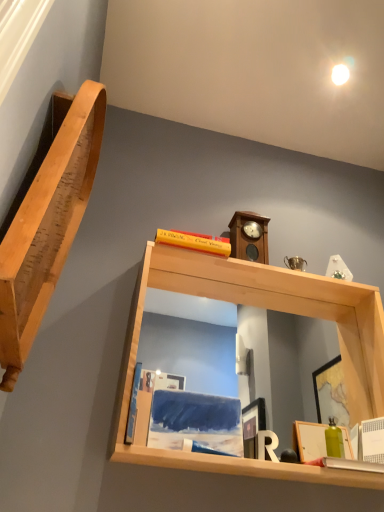
Question: Should I look upward or downward to see wooden clock at upper center?

Choices:
 (A) up
 (B) down

Answer: (A)

Question: Is light wood/matte mirror at upper center, arranged as the first shelf when viewed from the right, next to natural wood shelf at left, arranged as the 1th shelf when viewed from the left, and touching it?

Choices:
 (A) no
 (B) yes

Answer: (A)

Question: Can you confirm if light wood/matte mirror at upper center, the second shelf from the left, is shorter than natural wood shelf at left, arranged as the 1th shelf when viewed from the left?

Choices:
 (A) yes
 (B) no

Answer: (A)

Question: Is light wood/matte mirror at upper center, the second shelf from the left, located outside natural wood shelf at left, arranged as the 1th shelf when viewed from the left?

Choices:
 (A) no
 (B) yes

Answer: (B)

Question: From a real-world perspective, does light wood/matte mirror at upper center, arranged as the first shelf when viewed from the right, sit lower than natural wood shelf at left, arranged as the 1th shelf when viewed from the left?

Choices:
 (A) yes
 (B) no

Answer: (A)

Question: Considering the relative positions of light wood/matte mirror at upper center, arranged as the first shelf when viewed from the right, and natural wood shelf at left, placed as the 2th shelf when sorted from right to left, in the image provided, is light wood/matte mirror at upper center, arranged as the first shelf when viewed from the right, to the left of natural wood shelf at left, placed as the 2th shelf when sorted from right to left, from the viewer's perspective?

Choices:
 (A) no
 (B) yes

Answer: (A)

Question: Could you tell me if light wood/matte mirror at upper center, arranged as the first shelf when viewed from the right, is facing natural wood shelf at left, arranged as the 1th shelf when viewed from the left?

Choices:
 (A) no
 (B) yes

Answer: (A)

Question: Is natural wood shelf at left, placed as the 2th shelf when sorted from right to left, oriented towards light wood/matte mirror at upper center, the second shelf from the left?

Choices:
 (A) no
 (B) yes

Answer: (B)

Question: Is natural wood shelf at left, placed as the 2th shelf when sorted from right to left, smaller than light wood/matte mirror at upper center, the second shelf from the left?

Choices:
 (A) yes
 (B) no

Answer: (A)

Question: Does natural wood shelf at left, placed as the 2th shelf when sorted from right to left, have a greater height compared to light wood/matte mirror at upper center, the second shelf from the left?

Choices:
 (A) no
 (B) yes

Answer: (B)

Question: Does natural wood shelf at left, arranged as the 1th shelf when viewed from the left, appear on the left side of light wood/matte mirror at upper center, the second shelf from the left?

Choices:
 (A) no
 (B) yes

Answer: (B)

Question: Is natural wood shelf at left, arranged as the 1th shelf when viewed from the left, looking in the opposite direction of light wood/matte mirror at upper center, the second shelf from the left?

Choices:
 (A) yes
 (B) no

Answer: (B)

Question: From the image's perspective, is natural wood shelf at left, placed as the 2th shelf when sorted from right to left, below light wood/matte mirror at upper center, arranged as the first shelf when viewed from the right?

Choices:
 (A) no
 (B) yes

Answer: (A)

Question: Is the depth of matte wooden picture frame at lower right less than that of blue matte book at lower left?

Choices:
 (A) yes
 (B) no

Answer: (B)